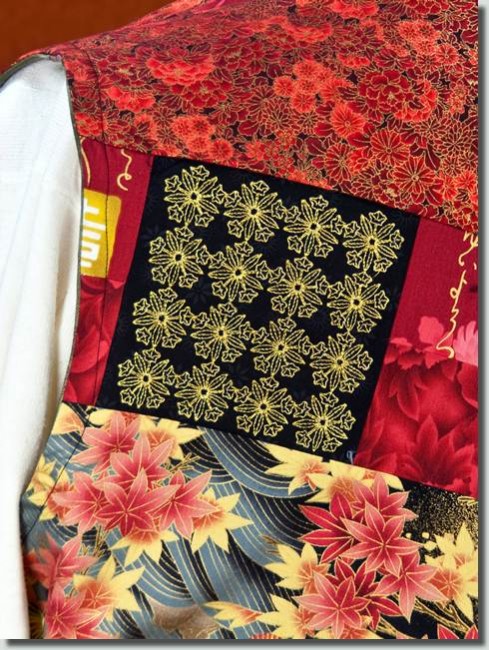
Where is `bottom section of pillow case`? bottom section of pillow case is located at coordinates (277, 608).